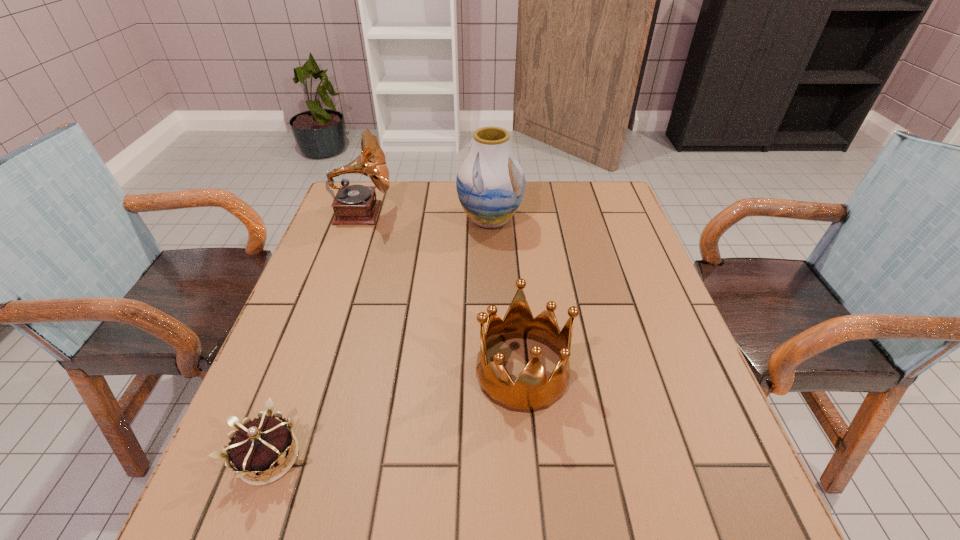
What are the coordinates of `vacant space that satisfies the following two spatial constraints: 1. on the front side of the vase; 2. on the left side of the third tallest object` in the screenshot? It's located at (494, 372).

You are a GUI agent. You are given a task and a screenshot of the screen. Output one action in this format:
    pyautogui.click(x=<x>, y=<y>)
    Task: Click on the free location that satisfies the following two spatial constraints: 1. on the horn of the vase; 2. on the left side of the phonograph_record
    
    Given the screenshot: What is the action you would take?
    pyautogui.click(x=360, y=220)